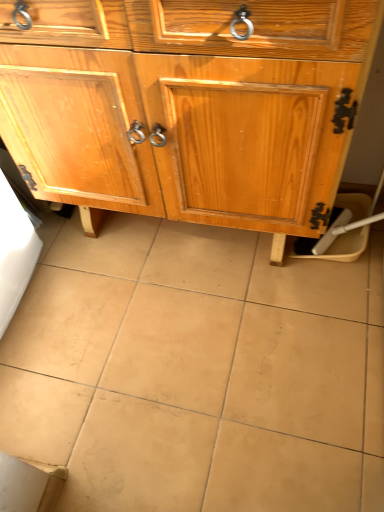
Question: From a real-world perspective, relative to wooden cabinet at center, is beige ceramic tile at center vertically above or below?

Choices:
 (A) above
 (B) below

Answer: (B)

Question: Is point (347, 451) closer or farther from the camera than point (180, 155)?

Choices:
 (A) closer
 (B) farther

Answer: (B)

Question: Looking at the image, does beige ceramic tile at center seem bigger or smaller compared to wooden cabinet at center?

Choices:
 (A) big
 (B) small

Answer: (B)

Question: In terms of height, does wooden cabinet at center look taller or shorter compared to beige ceramic tile at center?

Choices:
 (A) short
 (B) tall

Answer: (B)

Question: From the image's perspective, is wooden cabinet at center above or below beige ceramic tile at center?

Choices:
 (A) above
 (B) below

Answer: (A)

Question: Is wooden cabinet at center in front of or behind beige ceramic tile at center in the image?

Choices:
 (A) front
 (B) behind

Answer: (A)

Question: Looking at their shapes, would you say wooden cabinet at center is wider or thinner than beige ceramic tile at center?

Choices:
 (A) wide
 (B) thin

Answer: (B)